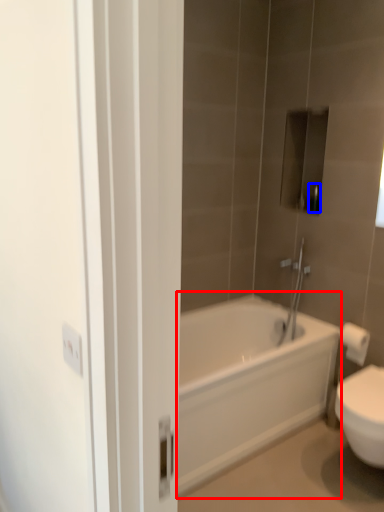
Question: Which of the following is the farthest to the observer, bathtub (highlighted by a red box) or toiletry (highlighted by a blue box)?

Choices:
 (A) bathtub
 (B) toiletry

Answer: (B)